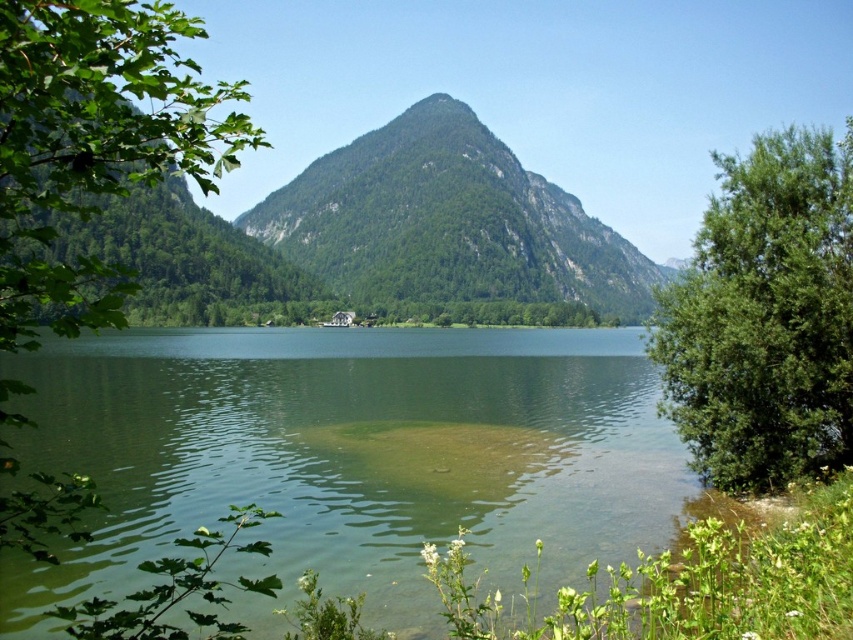
Find the location of a particular element. green translucent water at center is located at coordinates (351, 454).

Measure the distance between green translucent water at center and camera.

Result: A distance of 89.89 feet exists between green translucent water at center and camera.

Where is `green translucent water at center`? green translucent water at center is located at coordinates (351, 454).

Does green leafy tree at left have a smaller size compared to green forested mountain at center?

Yes.

Between green leafy tree at left and green forested mountain at center, which one is positioned higher?

Positioned higher is green forested mountain at center.

Find the location of `green leafy tree at left`. green leafy tree at left is located at coordinates (93, 145).

Can you confirm if green leafy bush at right is positioned below green forested mountain at center?

Yes, green leafy bush at right is below green forested mountain at center.

Is green leafy bush at right positioned in front of green forested mountain at center?

Yes, it is.

Who is more forward, (712, 216) or (434, 234)?

Point (712, 216)

Locate an element on the screen. The width and height of the screenshot is (853, 640). green leafy bush at right is located at coordinates (764, 317).